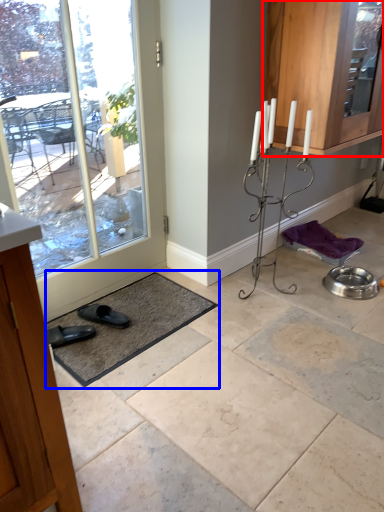
Question: Which of the following is the closest to the observer, cabinetry (highlighted by a red box) or bath mat (highlighted by a blue box)?

Choices:
 (A) cabinetry
 (B) bath mat

Answer: (B)